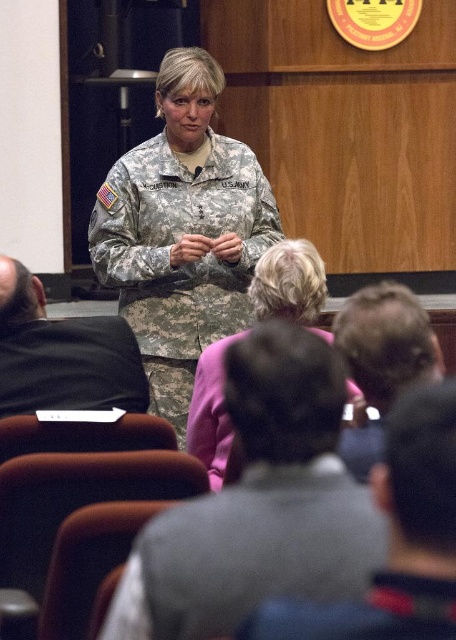
Question: Which object is positioned farthest from the pink fabric jacket at center?

Choices:
 (A) gray fabric jacket at lower center
 (B) camouflage fabric uniform at center
 (C) gray fabric shirt at lower center
 (D) black cotton shirt at lower left

Answer: (C)

Question: Estimate the real-world distances between objects in this image. Which object is closer to the gray fabric shirt at lower center?

Choices:
 (A) camouflage fabric uniform at center
 (B) gray fabric jacket at lower center
 (C) black cotton shirt at lower left

Answer: (B)

Question: Can you confirm if gray fabric jacket at lower center is positioned below black cotton shirt at lower left?

Choices:
 (A) no
 (B) yes

Answer: (B)

Question: Which point appears closest to the camera in this image?

Choices:
 (A) (388, 580)
 (B) (320, 342)
 (C) (181, 168)
 (D) (224, 429)

Answer: (A)

Question: Is gray fabric shirt at lower center thinner than black cotton shirt at lower left?

Choices:
 (A) no
 (B) yes

Answer: (B)

Question: Can you confirm if camouflage fabric uniform at center is wider than black cotton shirt at lower left?

Choices:
 (A) no
 (B) yes

Answer: (B)